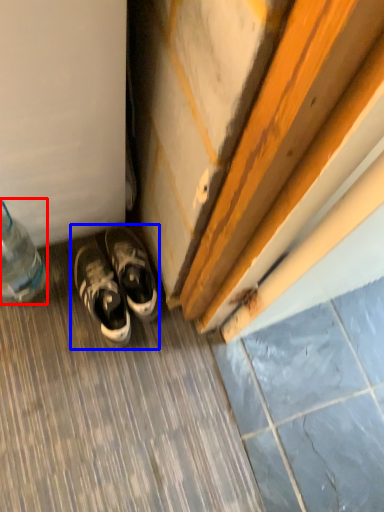
Question: Among these objects, which one is farthest to the camera, bottle (highlighted by a red box) or footwear (highlighted by a blue box)?

Choices:
 (A) bottle
 (B) footwear

Answer: (B)